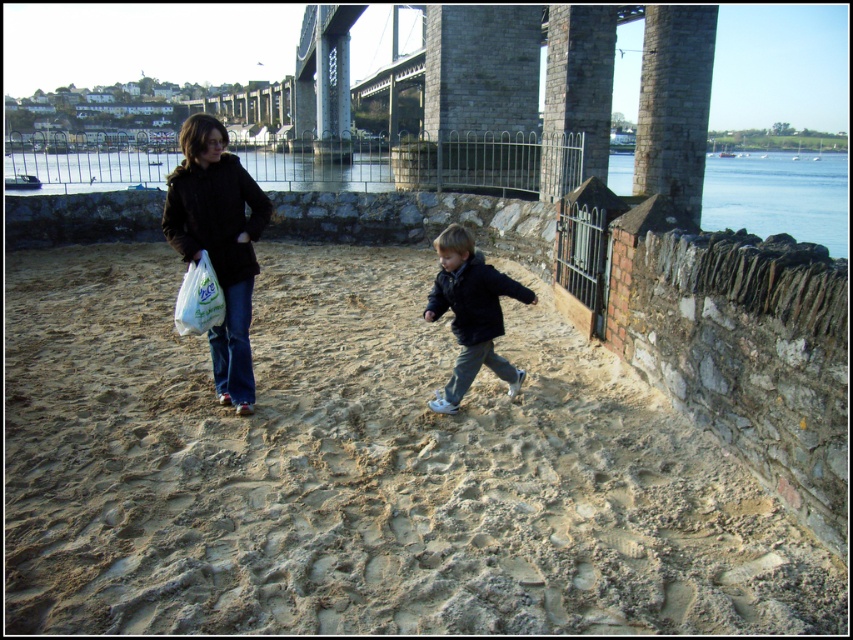
Question: Which point appears farthest from the camera in this image?

Choices:
 (A) (465, 262)
 (B) (224, 307)
 (C) (482, 321)

Answer: (C)

Question: Does blue denim jeans at left have a smaller size compared to white plastic bag at center?

Choices:
 (A) yes
 (B) no

Answer: (B)

Question: Can you confirm if stone bridge at upper center is smaller than white plastic bag at center?

Choices:
 (A) yes
 (B) no

Answer: (B)

Question: Which object appears farthest from the camera in this image?

Choices:
 (A) denim jeans at center
 (B) black matte jacket at upper left
 (C) blue water at upper center

Answer: (C)

Question: Does blue denim jeans at left appear over denim jeans at center?

Choices:
 (A) no
 (B) yes

Answer: (B)

Question: Which is farther from the brown sandy beach at center?

Choices:
 (A) white plastic bag at center
 (B) dark blue jacket at center
 (C) denim jeans at center
 (D) matte black jacket at left

Answer: (A)